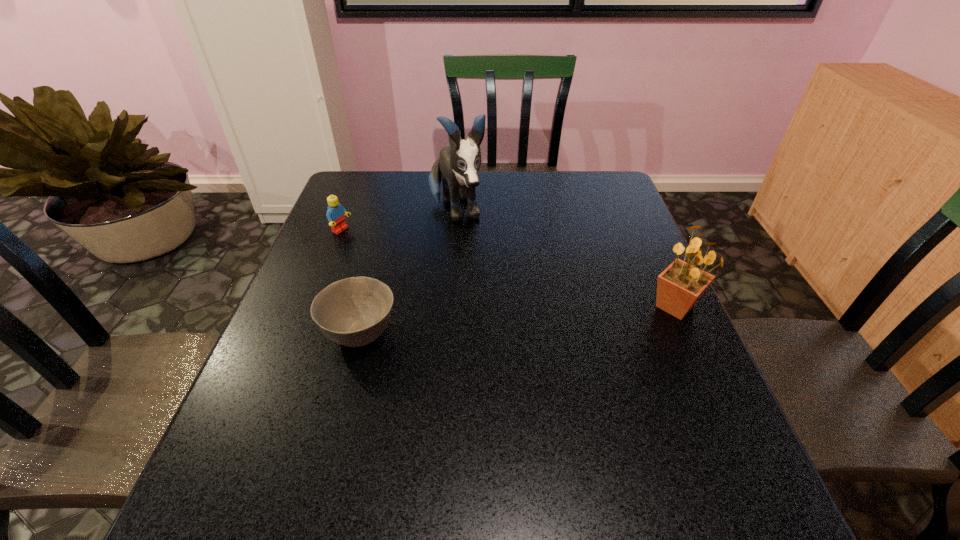
You are a GUI agent. You are given a task and a screenshot of the screen. Output one action in this format:
    pyautogui.click(x=<x>, y=<y>)
    Task: Click on the free spot at the right edge of the desktop
    This screenshot has width=960, height=540.
    Given the screenshot: What is the action you would take?
    pyautogui.click(x=690, y=366)

Find the location of `free point at the near left corner`. free point at the near left corner is located at coordinates (274, 430).

You are a GUI agent. You are given a task and a screenshot of the screen. Output one action in this format:
    pyautogui.click(x=<x>, y=<y>)
    Task: Click on the vacant region at the far right corner
    Image resolution: width=960 pixels, height=540 pixels.
    Given the screenshot: What is the action you would take?
    pyautogui.click(x=591, y=184)

You are a GUI agent. You are given a task and a screenshot of the screen. Output one action in this format:
    pyautogui.click(x=<x>, y=<y>)
    Task: Click on the vacant space in between the third object from right to left and the puppy
    The width and height of the screenshot is (960, 540).
    Given the screenshot: What is the action you would take?
    pyautogui.click(x=408, y=273)

Locate an element on the screen. free space between the leftmost object and the sunflower is located at coordinates (508, 268).

Where is `free point between the rightmost object and the bowl`? This screenshot has width=960, height=540. free point between the rightmost object and the bowl is located at coordinates (517, 320).

Locate an element on the screen. free space that is in between the third object from left to right and the rightmost object is located at coordinates (565, 259).

Where is `vacant space in between the tallest object and the Lego`? Image resolution: width=960 pixels, height=540 pixels. vacant space in between the tallest object and the Lego is located at coordinates (399, 221).

At what (x,y) coordinates should I click in order to perform the action: click on vacant region between the second tallest object and the leftmost object. Please return your answer as a coordinate pair (x, y). The height and width of the screenshot is (540, 960). Looking at the image, I should click on (508, 268).

Identify the location of free area in between the leftmost object and the second tallest object. The image size is (960, 540). (508, 268).